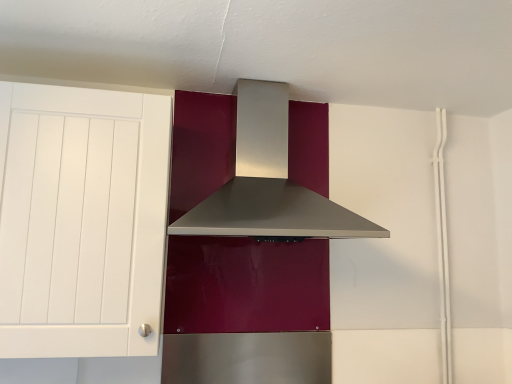
Question: Should I look upward or downward to see white matte cabinet at left?

Choices:
 (A) down
 (B) up

Answer: (A)

Question: Is satin silver range hood at center turned away from white matte cabinet at left?

Choices:
 (A) no
 (B) yes

Answer: (A)

Question: Is white matte cabinet at left a part of satin silver range hood at center?

Choices:
 (A) no
 (B) yes

Answer: (A)

Question: Is satin silver range hood at center at the right side of white matte cabinet at left?

Choices:
 (A) no
 (B) yes

Answer: (B)

Question: Is satin silver range hood at center taller than white matte cabinet at left?

Choices:
 (A) yes
 (B) no

Answer: (B)

Question: Is satin silver range hood at center in front of white matte cabinet at left?

Choices:
 (A) no
 (B) yes

Answer: (A)

Question: From the image's perspective, would you say satin silver range hood at center is positioned over white matte cabinet at left?

Choices:
 (A) yes
 (B) no

Answer: (A)

Question: Is white matte cabinet at left at the right side of satin silver range hood at center?

Choices:
 (A) yes
 (B) no

Answer: (B)

Question: Is white matte cabinet at left oriented away from satin silver range hood at center?

Choices:
 (A) no
 (B) yes

Answer: (A)

Question: Is white matte cabinet at left directly adjacent to satin silver range hood at center?

Choices:
 (A) no
 (B) yes

Answer: (A)

Question: Does white matte cabinet at left have a lesser height compared to satin silver range hood at center?

Choices:
 (A) no
 (B) yes

Answer: (A)

Question: Can you confirm if white matte cabinet at left is bigger than satin silver range hood at center?

Choices:
 (A) yes
 (B) no

Answer: (B)

Question: Can you confirm if white matte cabinet at left is smaller than satin silver range hood at center?

Choices:
 (A) no
 (B) yes

Answer: (B)

Question: From their relative heights in the image, would you say satin silver range hood at center is taller or shorter than white matte cabinet at left?

Choices:
 (A) short
 (B) tall

Answer: (A)